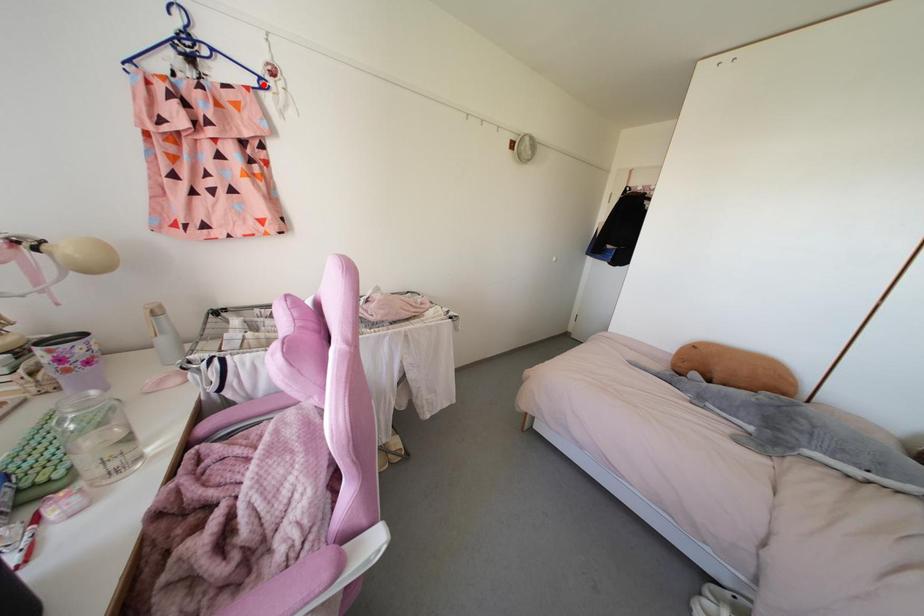
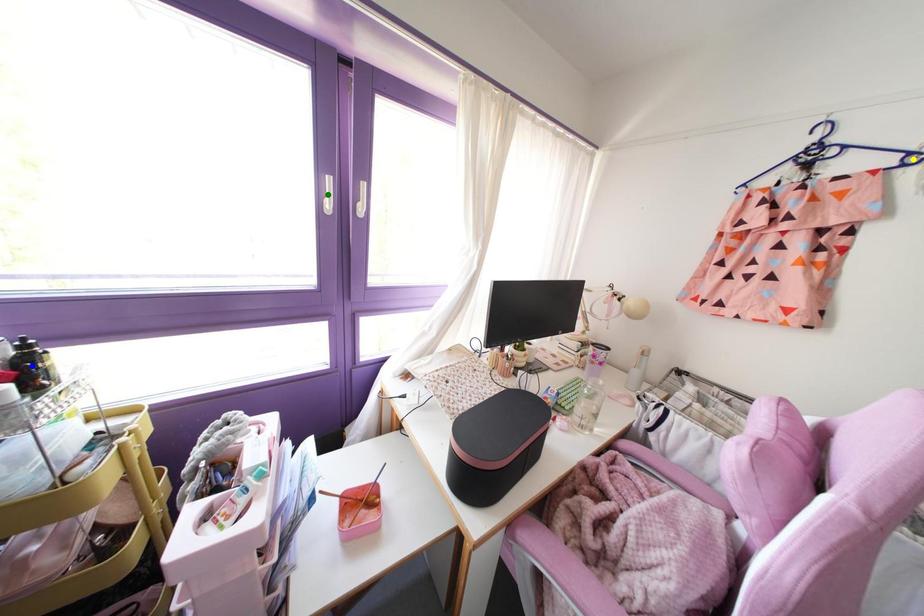
Question: I am providing you with two images of the same scene from different viewpoints. A red point is marked on the first image. You are given multiple points on the second image. Which point in image 2 represents the same 3d spot as the red point in image 1?

Choices:
 (A) blue point
 (B) yellow point
 (C) green point

Answer: (B)